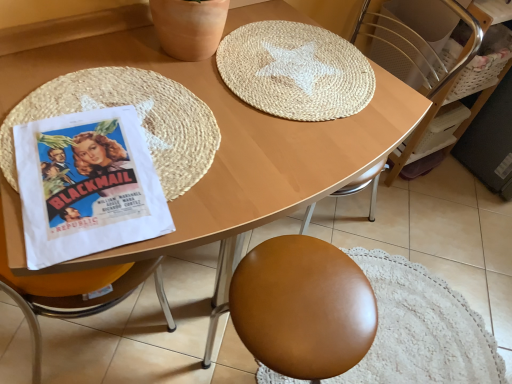
At what (x,y) coordinates should I click in order to perform the action: click on empty space that is to the right of wooden at upper center. Please return your answer as a coordinate pair (x, y). The width and height of the screenshot is (512, 384). Looking at the image, I should click on pyautogui.click(x=409, y=242).